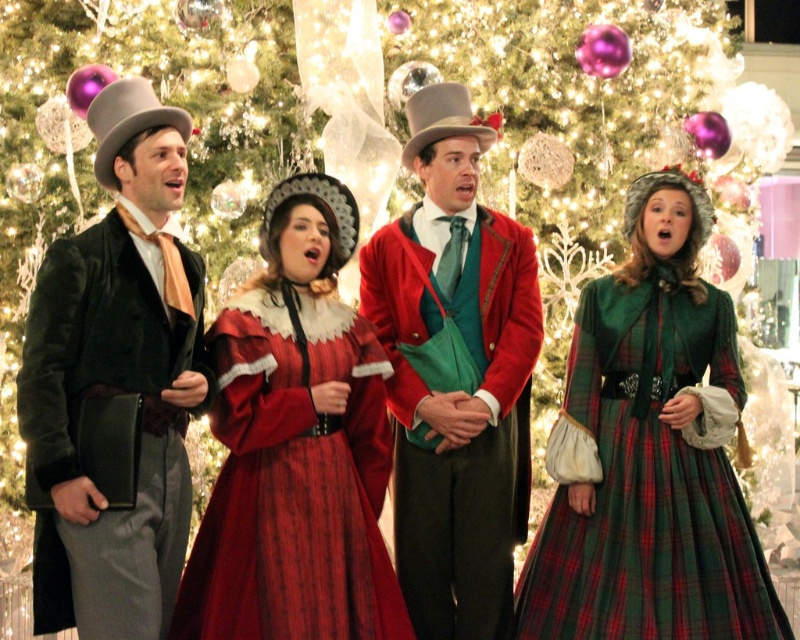
Question: Which object is closer to the camera taking this photo?

Choices:
 (A) velvet red coat at center
 (B) velvet black coat at left

Answer: (B)

Question: Which point is closer to the camera?

Choices:
 (A) (649, 182)
 (B) (169, 218)

Answer: (B)

Question: Is velvet red dress at center to the left of velvet black coat at left from the viewer's perspective?

Choices:
 (A) no
 (B) yes

Answer: (A)

Question: Is velvet red coat at center behind felt dress hat at center?

Choices:
 (A) yes
 (B) no

Answer: (A)

Question: Which of the following is the closest to the observer?

Choices:
 (A) velvet black coat at left
 (B) green plaid dress at center
 (C) matte gray dress hat at left

Answer: (A)

Question: Is velvet black coat at left bigger than green plaid dress at center?

Choices:
 (A) no
 (B) yes

Answer: (B)